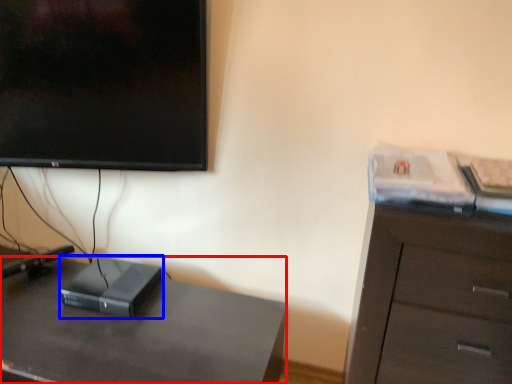
Question: Which object is closer to the camera taking this photo, desk (highlighted by a red box) or computer (highlighted by a blue box)?

Choices:
 (A) desk
 (B) computer

Answer: (A)